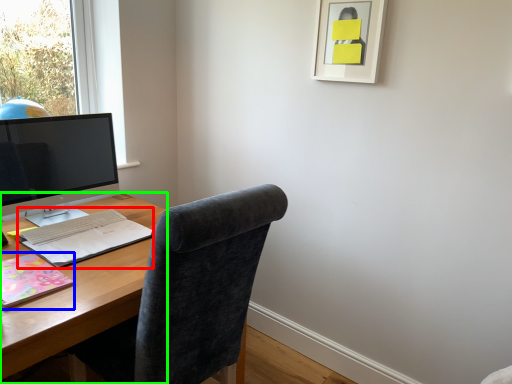
Question: Estimate the real-world distances between objects in this image. Which object is closer to notebook (highlighted by a red box), notebook (highlighted by a blue box) or desk (highlighted by a green box)?

Choices:
 (A) notebook
 (B) desk

Answer: (B)